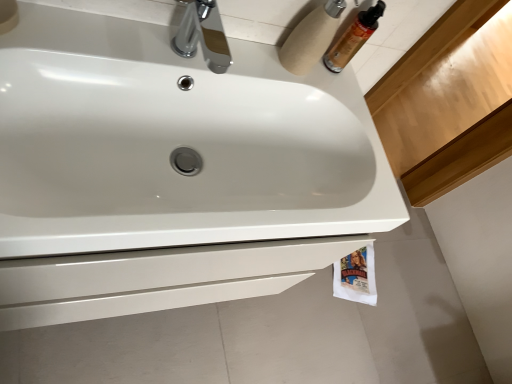
Image resolution: width=512 pixels, height=384 pixels. Find the location of `vacant area located to the right-hand side of white cardboard toilet paper at upper right, which is the 2th toilet paper from right to left`. vacant area located to the right-hand side of white cardboard toilet paper at upper right, which is the 2th toilet paper from right to left is located at coordinates (339, 92).